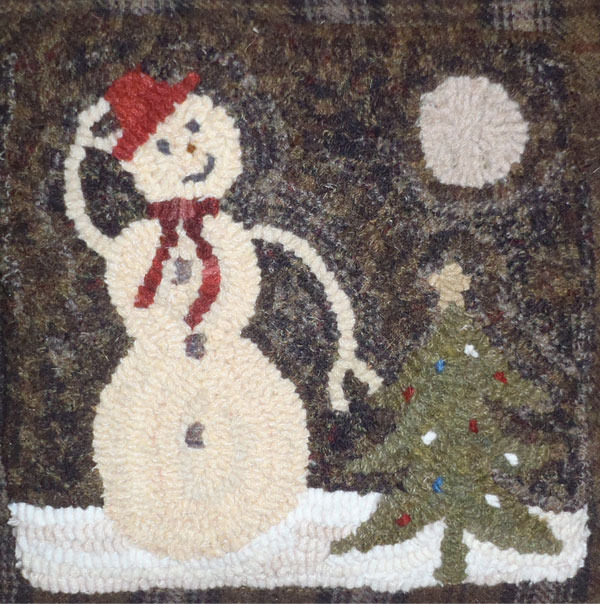
Identify the location of christmas tree. The image size is (600, 604). (443, 394).